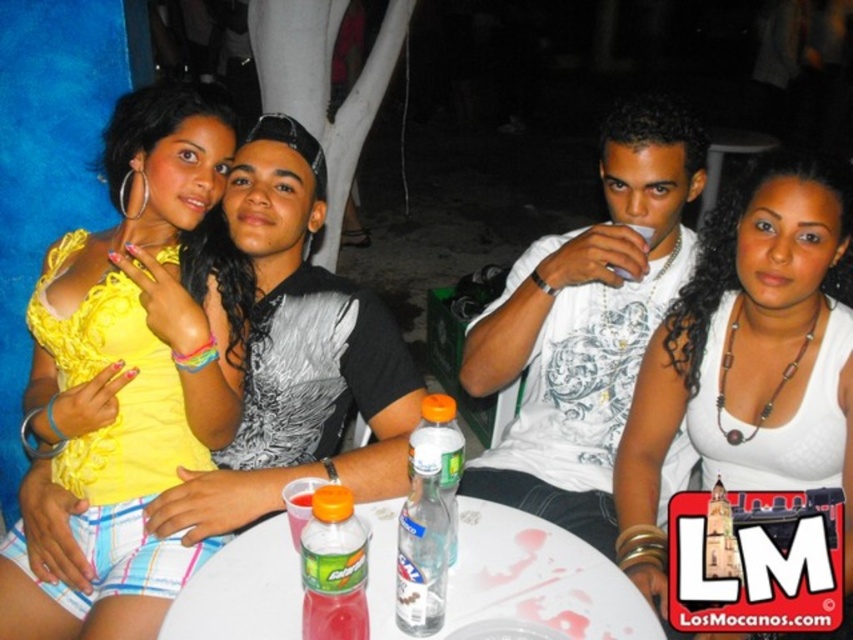
From the picture: You are a server at a bar and you see the white matte tank top at center and the translucent plastic bottle at table center. Which object is placed on top of the other?

The white matte tank top at center is positioned over the translucent plastic bottle at table center.

You are a photographer at the scene and want to capture a clear shot of both the white matte tank top at center and the translucent plastic bottle at table center. Since the camera can only focus on one object at a time, which object should you choose to ensure the larger one is in focus?

The white matte tank top at center is bigger than the translucent plastic bottle at table center, so you should focus on the white matte tank top at center to ensure the larger object is in focus.

Based on the scene description, which object is larger in size between the yellow woven tank top at upper left and the white plastic table at center?

The yellow woven tank top at upper left is bigger than the white plastic table at center according to the description.